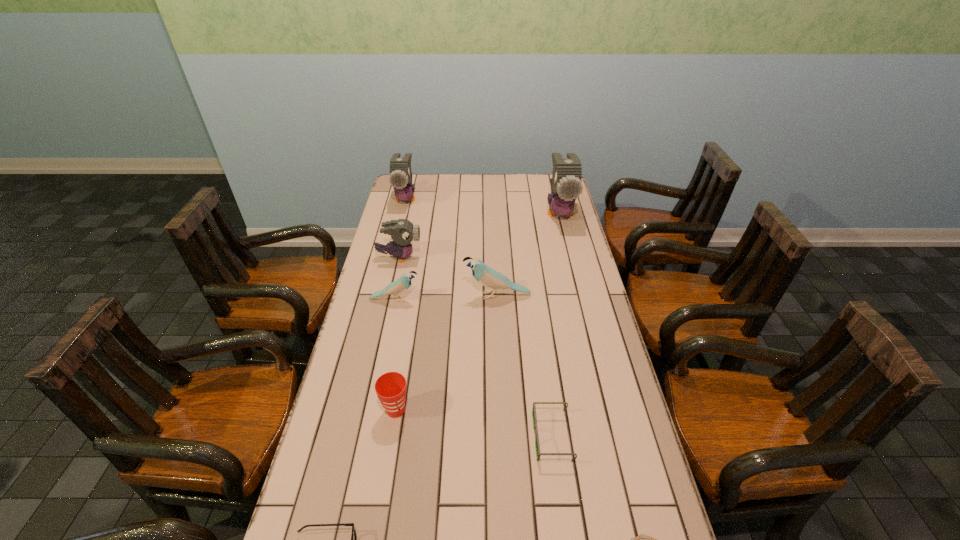
This screenshot has height=540, width=960. In order to click on the tallest object in this screenshot , I will do `click(566, 185)`.

Identify the location of the rightmost bird. (566, 185).

The height and width of the screenshot is (540, 960). What are the coordinates of `the eighth shortest object` in the screenshot? It's located at (400, 178).

Locate an element on the screen. Image resolution: width=960 pixels, height=540 pixels. the second smallest gray bird is located at coordinates (400, 178).

You are a GUI agent. You are given a task and a screenshot of the screen. Output one action in this format:
    pyautogui.click(x=<x>, y=<y>)
    Task: Click on the bigger blue bird
    
    Given the screenshot: What is the action you would take?
    pyautogui.click(x=488, y=277)

Where is `the second bird from right to left`? the second bird from right to left is located at coordinates pos(488,277).

Where is `the third nearest bird`? Image resolution: width=960 pixels, height=540 pixels. the third nearest bird is located at coordinates (402, 231).

This screenshot has width=960, height=540. Identify the location of the smallest gray bird. (402, 231).

The height and width of the screenshot is (540, 960). Find the location of `the smaller blue bird`. the smaller blue bird is located at coordinates (x=402, y=284).

This screenshot has height=540, width=960. Find the location of `the left blue bird`. the left blue bird is located at coordinates (402, 284).